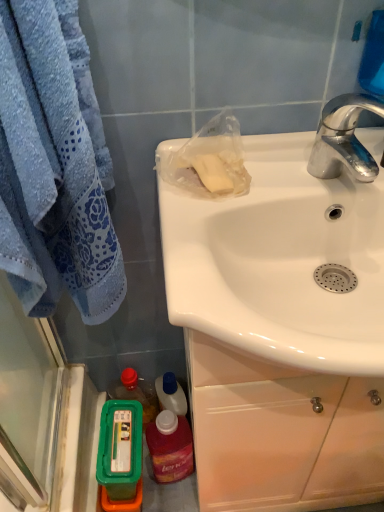
Question: Does point (100, 472) appear closer or farther from the camera than point (306, 162)?

Choices:
 (A) farther
 (B) closer

Answer: (A)

Question: Is green plastic container at lower left, the first mouthwash in the left-to-right sequence, inside or outside of white glossy sink at upper right?

Choices:
 (A) outside
 (B) inside

Answer: (A)

Question: Which object is the farthest from the soft blue towel at left?

Choices:
 (A) translucent plastic mouthwash at lower left, the first mouthwash from the right
 (B) chrome metallic faucet at upper right
 (C) green plastic container at lower left, the 2th mouthwash viewed from the right
 (D) white glossy sink at upper right
 (E) green plastic container at lower left

Answer: (E)

Question: Which of these objects is positioned farthest from the green plastic container at lower left?

Choices:
 (A) translucent plastic mouthwash at lower left, the first mouthwash from the right
 (B) soft blue towel at left
 (C) white glossy sink at upper right
 (D) chrome metallic faucet at upper right
 (E) green plastic container at lower left, the first mouthwash in the left-to-right sequence

Answer: (D)